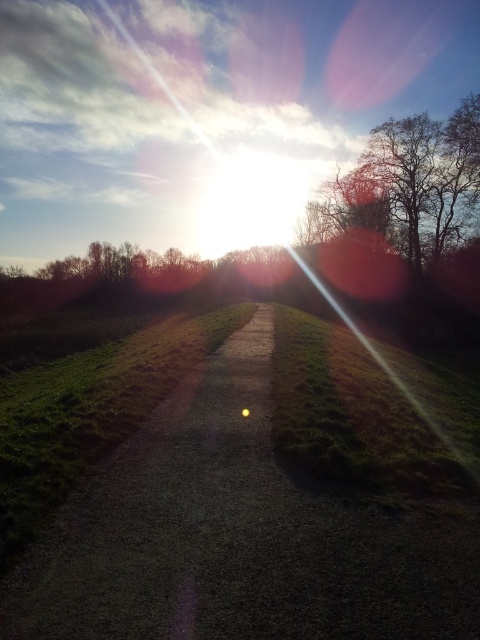
You are standing at the point marked by the coordinates point (238,536) on the gravel path at center. You want to walk straight ahead along the path. Which direction should you face to continue along the gravel path at center?

The gravel path at center is represented by point (238,536), so you should face the direction of the path extending forward from that point to continue along the gravel path at center.

You are standing at the starting point of the gravel path at center. If you walk straight ahead, where will you end up? Please provide coordinates based on the image.

The gravel path at center is located at coordinates point (238, 536), so walking straight ahead along the path would lead you to the direction of those coordinates.